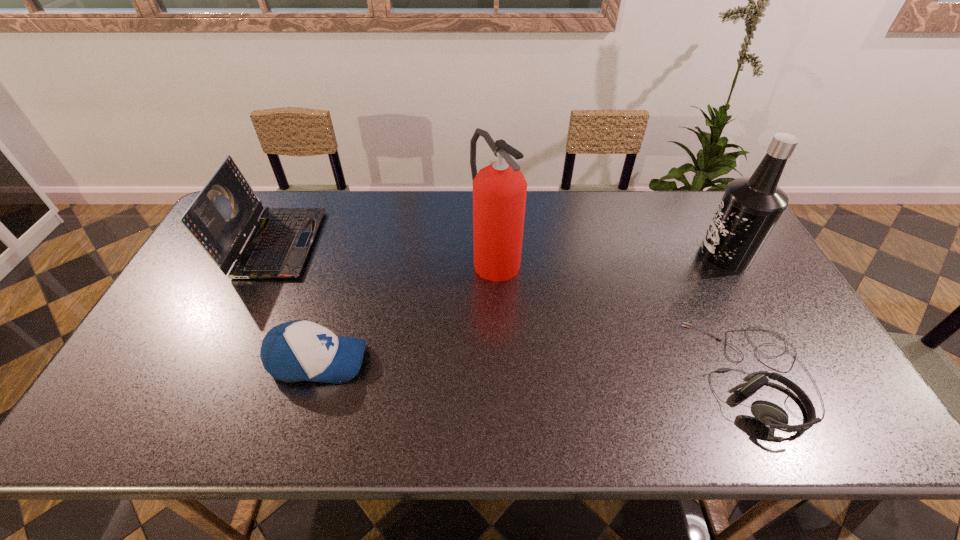
Where is `empty location between the fire extinguisher and the liquor`? The width and height of the screenshot is (960, 540). empty location between the fire extinguisher and the liquor is located at coordinates (610, 257).

Where is `vacant space that's between the laptop computer and the headset`? vacant space that's between the laptop computer and the headset is located at coordinates (516, 309).

The height and width of the screenshot is (540, 960). I want to click on vacant area that lies between the shortest object and the leftmost object, so click(x=516, y=309).

Locate an element on the screen. free space between the leftmost object and the fourth object from right to left is located at coordinates (297, 302).

Where is `free space between the headset and the liquor`? free space between the headset and the liquor is located at coordinates coord(739,316).

Where is `empty space that is in between the third object from right to left and the headset`? Image resolution: width=960 pixels, height=540 pixels. empty space that is in between the third object from right to left and the headset is located at coordinates 625,316.

Select which object appears as the fourth closest to the fire extinguisher. Please provide its 2D coordinates. Your answer should be formatted as a tuple, i.e. [(x, y)], where the tuple contains the x and y coordinates of a point satisfying the conditions above.

[(750, 207)]

At what (x,y) coordinates should I click in order to perform the action: click on object that is the fourth closest to the second shortest object. Please return your answer as a coordinate pair (x, y). The height and width of the screenshot is (540, 960). Looking at the image, I should click on (750, 207).

Where is `free space that satisfies the following two spatial constraints: 1. on the handle side of the fire extinguisher; 2. on the front-facing side of the fourth tallest object`? Image resolution: width=960 pixels, height=540 pixels. free space that satisfies the following two spatial constraints: 1. on the handle side of the fire extinguisher; 2. on the front-facing side of the fourth tallest object is located at coordinates (498, 361).